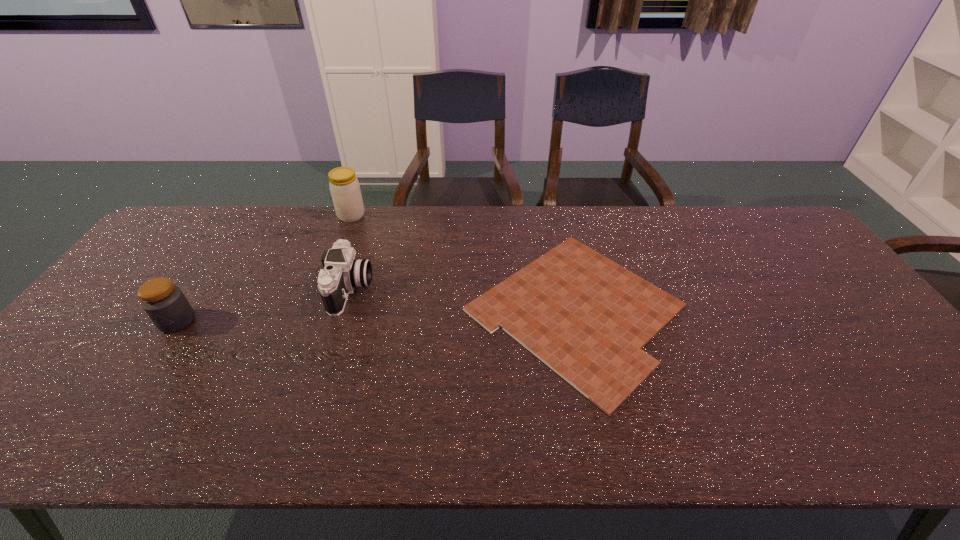
The height and width of the screenshot is (540, 960). In order to click on free spot located on the back of the shortest object in this screenshot , I will do `click(554, 212)`.

Where is `jar located in the far edge section of the desktop`? The height and width of the screenshot is (540, 960). jar located in the far edge section of the desktop is located at coordinates (345, 190).

Image resolution: width=960 pixels, height=540 pixels. Find the location of `gameboard at the far edge`. gameboard at the far edge is located at coordinates pos(586,317).

In order to click on object located at the near edge in this screenshot , I will do `click(586, 317)`.

This screenshot has width=960, height=540. In the image, there is a desktop. Find the location of `blank space at the far edge`. blank space at the far edge is located at coordinates (243, 239).

This screenshot has height=540, width=960. In the image, there is a desktop. Identify the location of free region at the near edge. (84, 414).

I want to click on free space at the left edge of the desktop, so click(190, 265).

Where is `free region at the right edge`? The width and height of the screenshot is (960, 540). free region at the right edge is located at coordinates (857, 322).

Locate an element on the screen. vacant space that is in between the left jar and the right jar is located at coordinates (264, 268).

At what (x,y) coordinates should I click in order to perform the action: click on empty space between the camera and the left jar. Please return your answer as a coordinate pair (x, y). The width and height of the screenshot is (960, 540). Looking at the image, I should click on (264, 305).